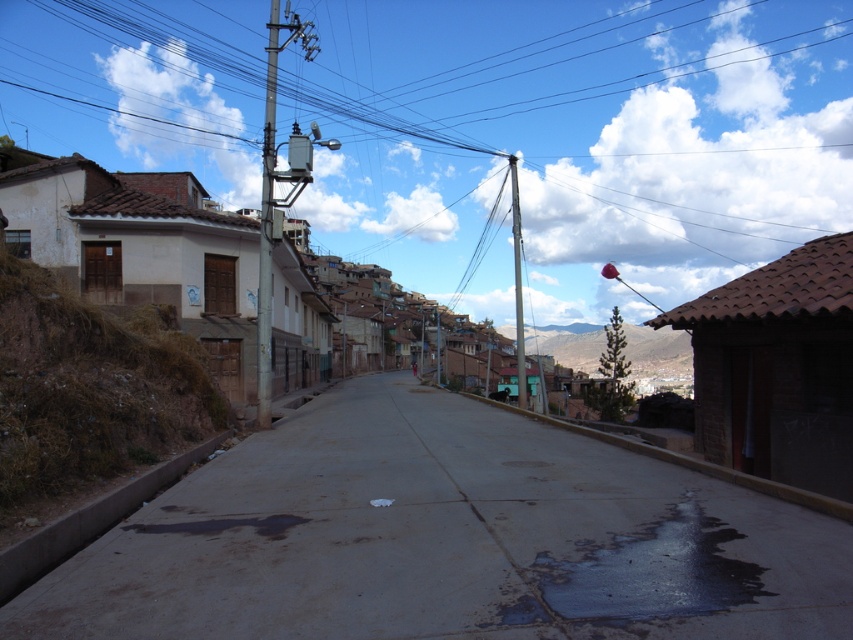
In the scene shown: Who is taller, smooth concrete alley at center or silver metallic telegraph pole at center-left?

silver metallic telegraph pole at center-left

The height and width of the screenshot is (640, 853). What do you see at coordinates (445, 538) in the screenshot?
I see `smooth concrete alley at center` at bounding box center [445, 538].

Image resolution: width=853 pixels, height=640 pixels. Identify the location of smooth concrete alley at center. (445, 538).

This screenshot has width=853, height=640. Identify the location of smooth concrete alley at center. (x=445, y=538).

Between point (271, 109) and point (523, 340), which one is positioned behind?

Point (271, 109)

Is concrete utility pole at center-left thinner than metallic gray pole at center-right?

No.

Identify the location of concrete utility pole at center-left. (265, 227).

Can you confirm if metallic gray power line at upper center is wider than silver metallic telegraph pole at center-left?

Indeed, metallic gray power line at upper center has a greater width compared to silver metallic telegraph pole at center-left.

Between point (3, 22) and point (270, 368), which one is positioned in front?

Point (270, 368)

Identify the location of metallic gray power line at upper center. (572, 86).